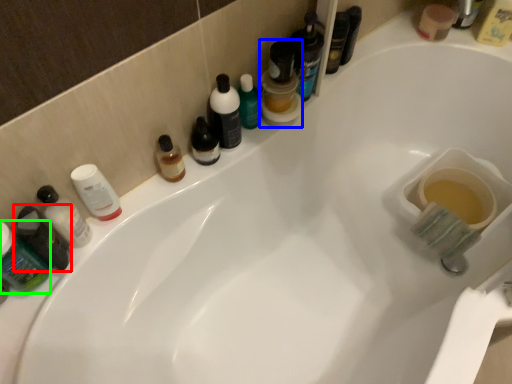
Question: Based on their relative distances, which object is farther from toiletry (highlighted by a red box)? Choose from mouthwash (highlighted by a blue box) and mouthwash (highlighted by a green box).

Choices:
 (A) mouthwash
 (B) mouthwash

Answer: (A)